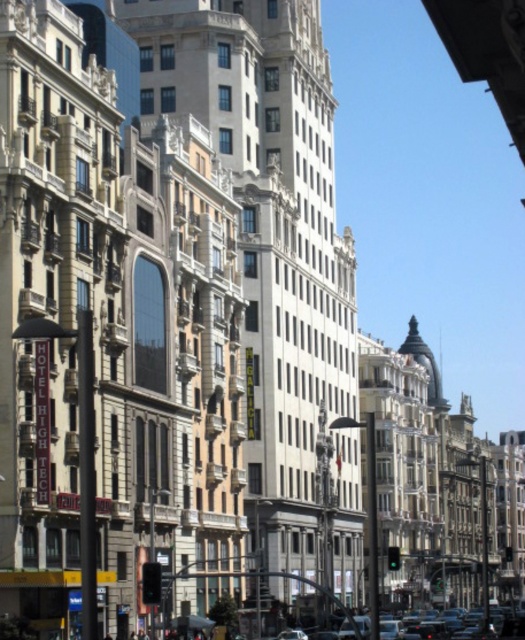
From the picture: Does black plastic traffic light at lower center have a lesser width compared to green glass traffic light at center?

Yes.

Does point (159, 563) come closer to viewer compared to point (397, 552)?

Yes, it is in front of point (397, 552).

Describe the element at coordinates (151, 582) in the screenshot. This screenshot has width=525, height=640. I see `black plastic traffic light at lower center` at that location.

Find the location of a particular element. The width and height of the screenshot is (525, 640). black plastic traffic light at lower center is located at coordinates pos(151,582).

Which is behind, point (252, 282) or point (148, 586)?

Point (252, 282)

Does point (307, 76) lie behind point (148, 588)?

Yes, it is.

At what (x,y) coordinates should I click in order to perform the action: click on smooth gray building at center. Please return your answer as a coordinate pair (x, y). Looking at the image, I should click on (275, 259).

Is smooth gray building at center thinner than green glass traffic light at center?

No.

Is smooth gray building at center wider than green glass traffic light at center?

Yes.

Identify the location of smooth gray building at center. (275, 259).